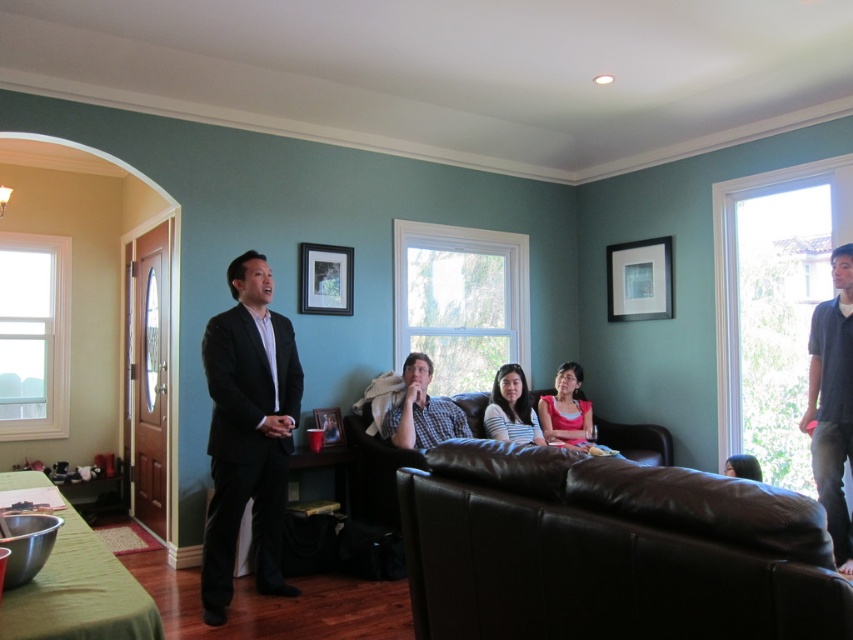
Question: Considering the relative positions of matte gray shirt at center and matte black hair at center in the image provided, where is matte gray shirt at center located with respect to matte black hair at center?

Choices:
 (A) below
 (B) above

Answer: (B)

Question: Can you confirm if matte gray shirt at center is positioned below pink matte shirt at center?

Choices:
 (A) no
 (B) yes

Answer: (A)

Question: Which of these objects is positioned farthest from the matte black hair at center?

Choices:
 (A) dark blue shirt at right
 (B) pink matte shirt at center
 (C) striped fabric shirt at center

Answer: (C)

Question: Observing the image, what is the correct spatial positioning of striped fabric shirt at center in reference to pink matte shirt at center?

Choices:
 (A) left
 (B) right

Answer: (A)

Question: Which object is the farthest from the matte black hair at center?

Choices:
 (A) black suit at left
 (B) matte gray shirt at center

Answer: (A)

Question: Among these objects, which one is nearest to the camera?

Choices:
 (A) matte black hair at center
 (B) dark blue shirt at right

Answer: (B)